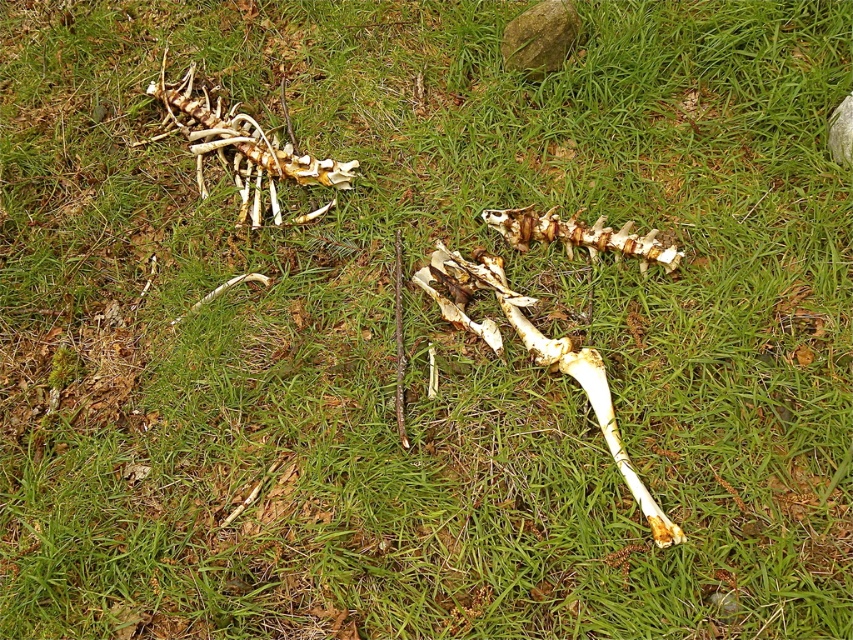
You are a wildlife researcher examining the scene. You notice a point marked at coordinates (241, 148). What object is located at that point?

The point at coordinates (241, 148) marks a white bone at upper left.

Based on the photo, you are a wildlife researcher examining the skeletal remains in the image. You notice two bones at the center of the scene. Which bone is bigger between the yellowish bone at center and the white bone at center?

The yellowish bone at center is larger in size than the white bone at center.

You are a wildlife researcher examining the skeletal remains in the image. You notice the white bone at upper left and the yellowish bone at center. Which bone is located to the left of the other?

The white bone at upper left is positioned on the left side of yellowish bone at center.